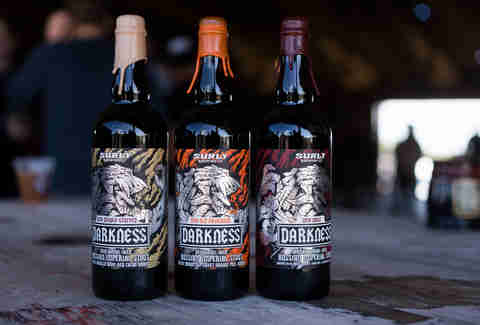
Image resolution: width=480 pixels, height=325 pixels. I want to click on light, so click(x=441, y=129).